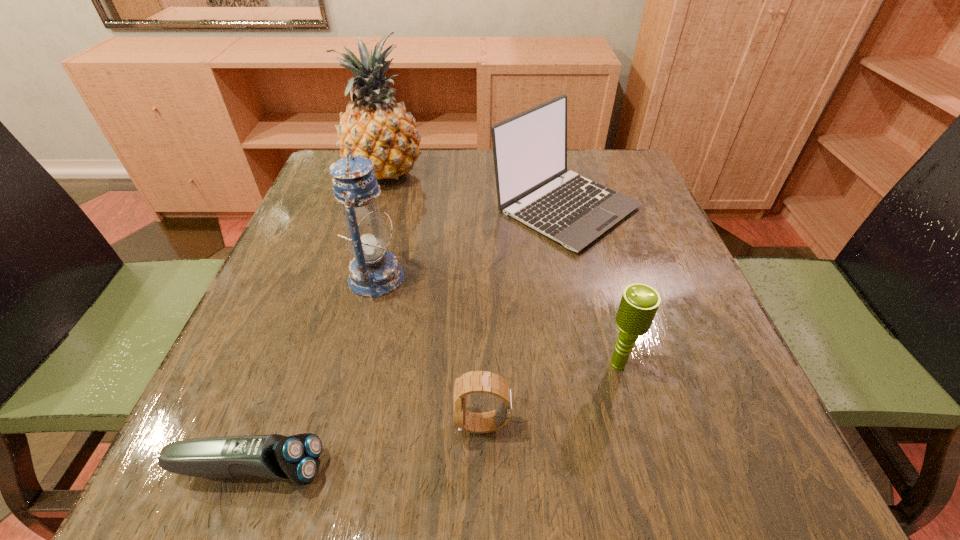
Locate an element on the screen. Image resolution: width=960 pixels, height=540 pixels. free space between the fourth shortest object and the shortest object is located at coordinates (408, 338).

Identify the location of unoccupied area between the tallest object and the fourth tallest object. (502, 268).

Identify the location of vacant area that lies between the watch and the fourth tallest object. The image size is (960, 540). (551, 394).

Find the location of `free space that is in between the fifth tallest object and the microphone`. free space that is in between the fifth tallest object and the microphone is located at coordinates (551, 394).

Where is `free spot between the fourth shortest object and the electric shaver`? Image resolution: width=960 pixels, height=540 pixels. free spot between the fourth shortest object and the electric shaver is located at coordinates (408, 338).

You are a GUI agent. You are given a task and a screenshot of the screen. Output one action in this format:
    pyautogui.click(x=<x>, y=<y>)
    Task: Click on the free spot between the lantern and the watch
    
    Given the screenshot: What is the action you would take?
    pyautogui.click(x=429, y=350)

At what (x,y) coordinates should I click in order to perform the action: click on unoccupied position between the shortest object and the second tallest object. Please return your answer as a coordinate pair (x, y). Looking at the image, I should click on (313, 373).

The image size is (960, 540). I want to click on object that stands as the third closest to the nearest object, so click(639, 303).

The image size is (960, 540). In order to click on the fifth closest object relative to the fourth shortest object in this screenshot , I will do `click(296, 458)`.

Identify the location of free location that satisfies the following two spatial constraints: 1. at the front screen of the third tallest object; 2. on the left side of the third nearest object. The width and height of the screenshot is (960, 540). (602, 364).